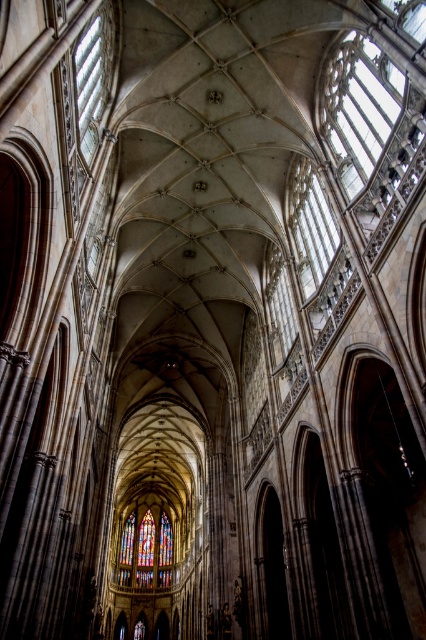
Question: Considering the real-world distances, which object is farthest from the clear glass window at upper left?

Choices:
 (A) clear glass window at upper right
 (B) stained glass at center

Answer: (B)

Question: Is clear glass at upper right below stained glass at center?

Choices:
 (A) no
 (B) yes

Answer: (A)

Question: Is clear glass window at upper right smaller than clear glass window at upper left?

Choices:
 (A) no
 (B) yes

Answer: (A)

Question: Based on their relative distances, which object is nearer to the stained glass at center?

Choices:
 (A) clear glass window at upper left
 (B) clear glass at upper right

Answer: (A)

Question: Which object is positioned farthest from the stained glass at center?

Choices:
 (A) clear glass window at upper left
 (B) clear glass at upper right
 (C) clear glass window at upper right

Answer: (B)

Question: Is clear glass at upper right to the left of clear glass window at upper right from the viewer's perspective?

Choices:
 (A) no
 (B) yes

Answer: (A)